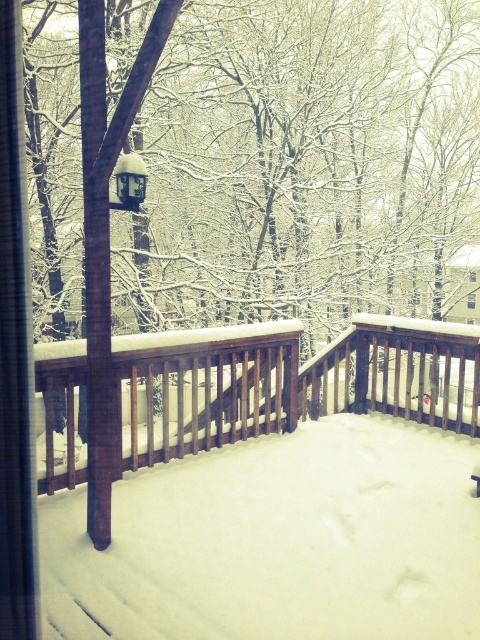
Which is more to the left, brown wooden railing at center or satin black lamp at center?

satin black lamp at center is more to the left.

Locate an element on the screen. brown wooden railing at center is located at coordinates (287, 381).

Is point (123, 458) less distant than point (140, 166)?

Yes, point (123, 458) is closer to viewer.

You are a GUI agent. You are given a task and a screenshot of the screen. Output one action in this format:
    pyautogui.click(x=<x>, y=<y>)
    Task: Click on the brown wooden railing at center
    Image resolution: width=480 pixels, height=640 pixels.
    Given the screenshot: What is the action you would take?
    pyautogui.click(x=287, y=381)